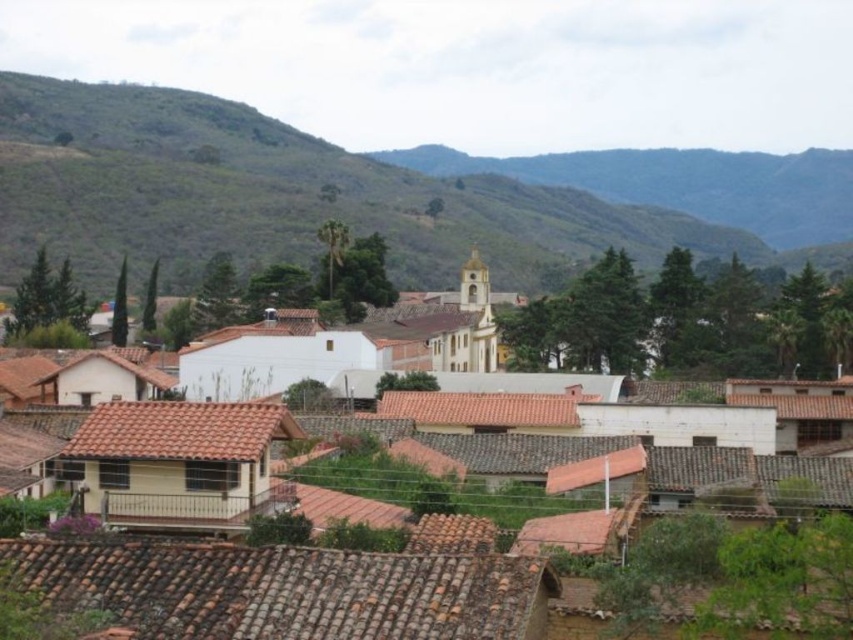
Who is lower down, white matte building at center or green grassy hillside at upper center?

Positioned lower is white matte building at center.

Who is positioned more to the right, white matte building at center or green grassy hillside at upper center?

white matte building at center is more to the right.

Between point (125, 618) and point (25, 124), which one is positioned behind?

Positioned behind is point (25, 124).

Where is `white matte building at center`? The image size is (853, 640). white matte building at center is located at coordinates (x=283, y=593).